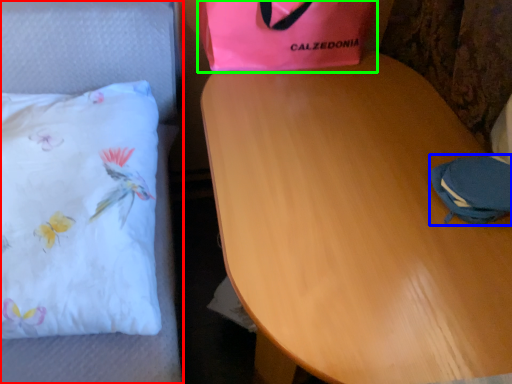
Question: Which object is the farthest from furniture (highlighted by a red box)? Choose among these: pouch (highlighted by a blue box) or gift bag (highlighted by a green box).

Choices:
 (A) pouch
 (B) gift bag

Answer: (A)